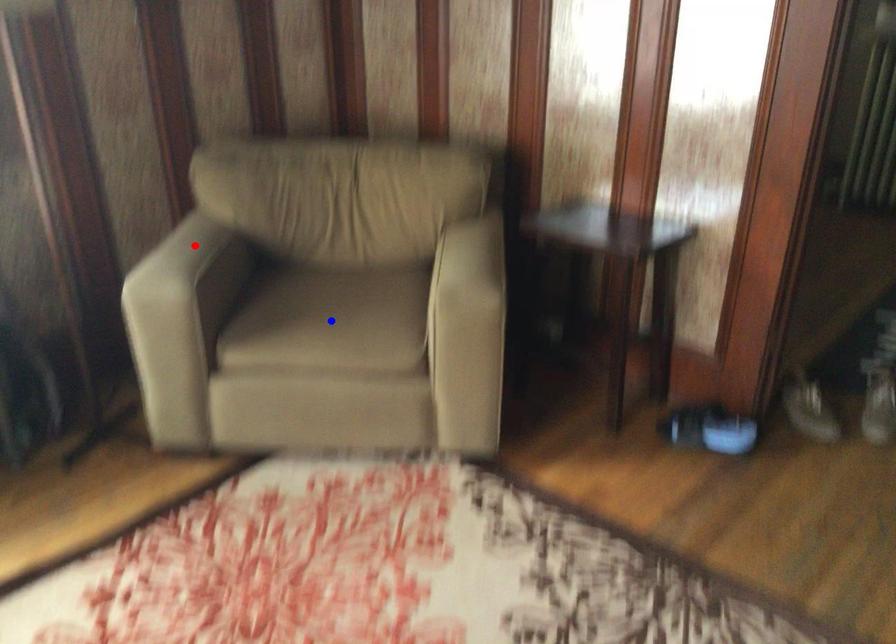
Question: In the image, two points are highlighted. Which point is nearer to the camera? Reply with the corresponding letter.

Choices:
 (A) blue point
 (B) red point

Answer: (A)